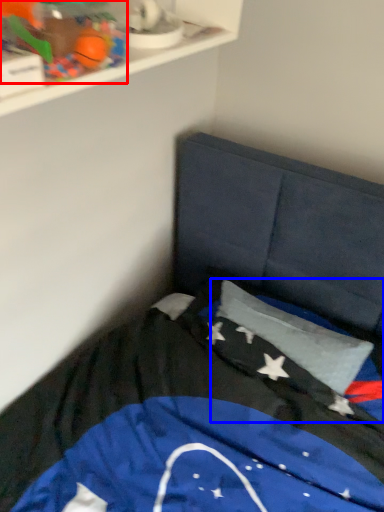
Question: Which object is further to the camera taking this photo, toy (highlighted by a red box) or flag (highlighted by a blue box)?

Choices:
 (A) toy
 (B) flag

Answer: (B)